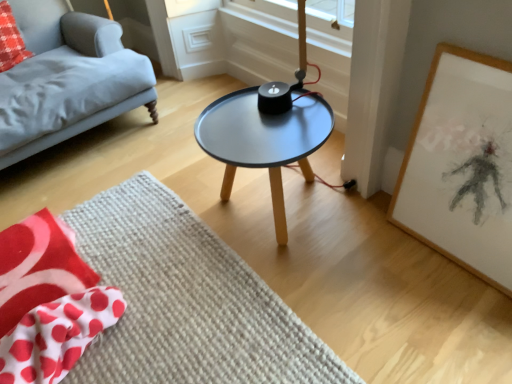
Find the location of a particular element. The width and height of the screenshot is (512, 384). vacant space in matte black table at center (from a real-world perspective) is located at coordinates (270, 215).